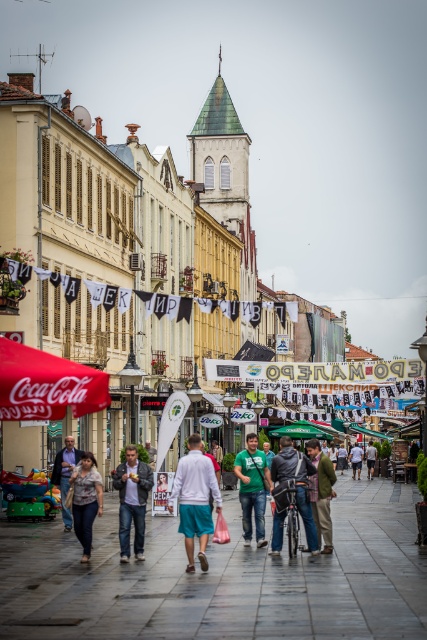
Question: Can you confirm if denim jacket at center is thinner than white cotton shirt at center?

Choices:
 (A) no
 (B) yes

Answer: (B)

Question: Estimate the real-world distances between objects in this image. Which object is closer to the dark gray fabric jacket at center?

Choices:
 (A) green matte shirt at center
 (B) denim jacket at center

Answer: (A)

Question: Does denim jacket at lower left have a smaller size compared to green fabric jacket at center?

Choices:
 (A) no
 (B) yes

Answer: (B)

Question: Which of the following is the farthest from the observer?

Choices:
 (A) (316, 440)
 (B) (245, 486)

Answer: (A)

Question: Does denim jacket at center lie behind green matte shirt at center?

Choices:
 (A) no
 (B) yes

Answer: (A)

Question: Which object is the closest to the denim jacket at center?

Choices:
 (A) denim jacket at lower left
 (B) green matte shirt at center
 (C) green fabric jacket at center
 (D) dark gray fabric jacket at center

Answer: (A)